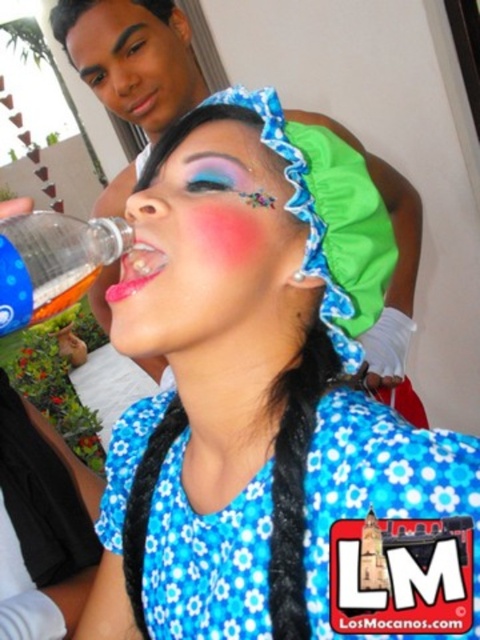
Can you confirm if blue floral fabric dress at center is positioned above smooth plastic bottle at upper left?

Actually, blue floral fabric dress at center is below smooth plastic bottle at upper left.

Is blue floral fabric dress at center bigger than smooth plastic bottle at upper left?

No.

Find the location of a particular element. blue floral fabric dress at center is located at coordinates (389, 525).

This screenshot has height=640, width=480. Describe the element at coordinates (389, 525) in the screenshot. I see `blue floral fabric dress at center` at that location.

Is point (360, 564) positioned before point (118, 4)?

Yes.

Find the location of a particular element. The width and height of the screenshot is (480, 640). blue floral fabric dress at center is located at coordinates (389, 525).

Does blue floral fabric dress at center have a lesser height compared to translucent plastic bottle at left?

No.

Can you confirm if blue floral fabric dress at center is taller than translucent plastic bottle at left?

Indeed, blue floral fabric dress at center has a greater height compared to translucent plastic bottle at left.

Where is `blue floral fabric dress at center`? The image size is (480, 640). blue floral fabric dress at center is located at coordinates (389, 525).